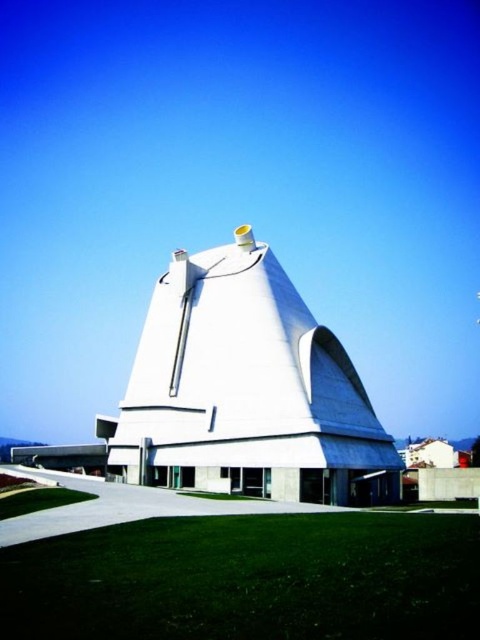
From the picture: You are standing at the edge of the green grass at lower left and want to reach the white concrete building at center. Which direction should you walk to get there?

The white concrete building at center is to the right of green grass at lower left, so you should walk to the right to reach it.

You are standing on the green grass at lower center and want to enter the white concrete building at center. Which direction should you walk to reach the building?

Since the green grass at lower center is positioned under the white concrete building at center, you should walk upwards or towards the center to reach the building.

You are a landscape architect designing a garden for the area around the building. You have two patches of green grass at lower center and green grass at lower left. Which patch of grass is bigger in size?

The green grass at lower center has a larger size compared to the green grass at lower left, so the patch at lower center is bigger.